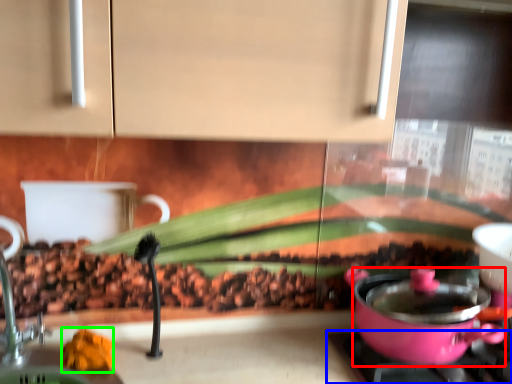
Question: Which object is the farthest from kitchen appliance (highlighted by a red box)? Choose among these: gas stove (highlighted by a blue box) or food (highlighted by a green box).

Choices:
 (A) gas stove
 (B) food

Answer: (B)